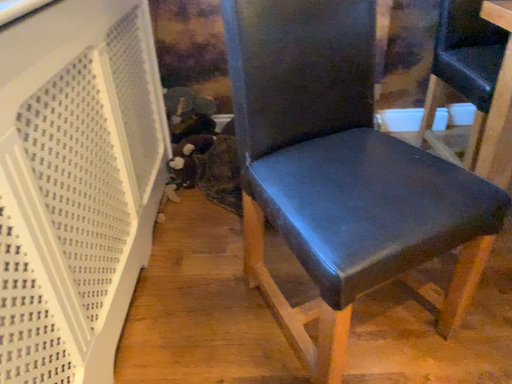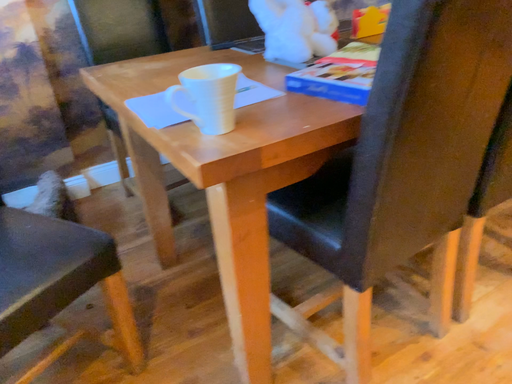
Question: How did the camera likely rotate when shooting the video?

Choices:
 (A) rotated upward
 (B) rotated downward

Answer: (A)